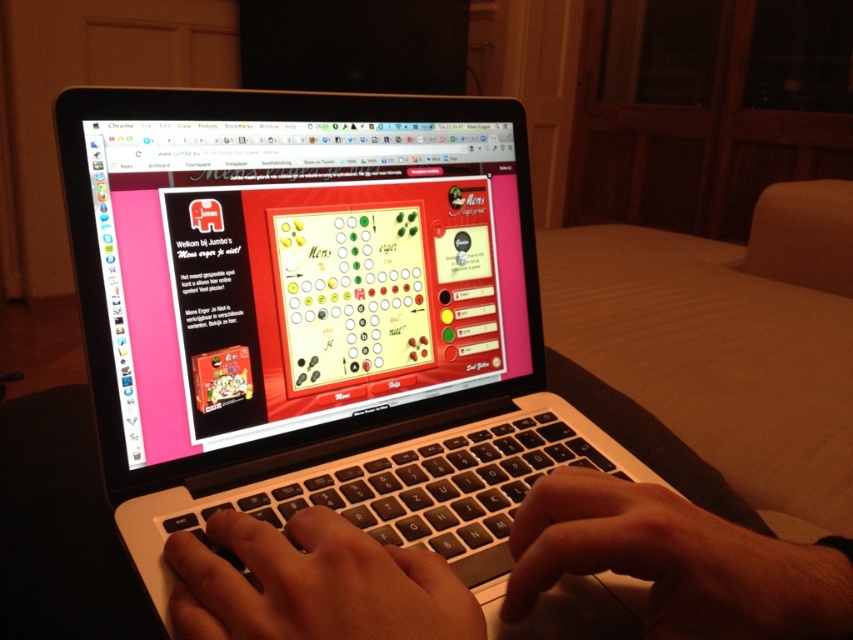
You are designing a new laptop stand and need to ensure it accommodates both the white plastic keyboard at center and the black matte hand at center. Given that the keyboard is wider than the hand, what should be the minimum width of the stand to comfortably fit both?

The white plastic keyboard at center is wider than the black matte hand at center. Therefore, the minimum width of the stand should be at least the width of the white plastic keyboard at center to comfortably accommodate both items.